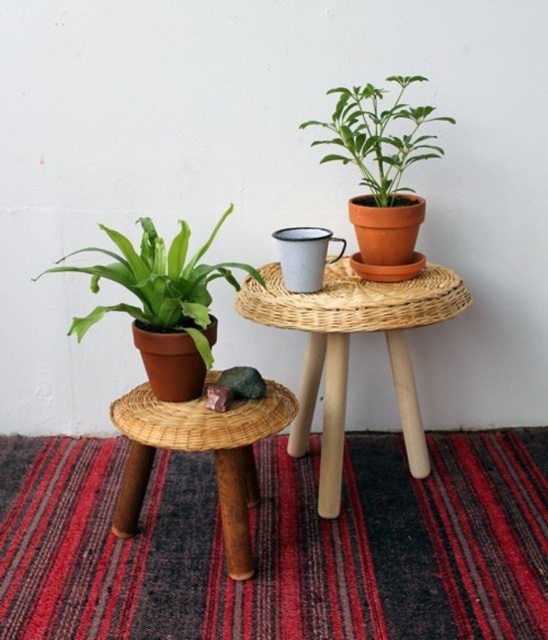
You are arranging a living room and need to place a tall potted plant that requires a sturdy base. Which object from the image, the woven wood table at center or the rattan stool at lower left, is better suited for supporting the plant?

The woven wood table at center is better suited for supporting the plant because it is above the rattan stool at lower left, indicating it has a larger surface area and stability.

You are arranging a small living room and see the rug with woven texture at lower center and the woven wood table at center. Which object is positioned to the left?

The rug with woven texture at lower center is to the left of the woven wood table at center.

Looking at this image, you are standing in front of the two tables and want to place a new decoration. If you place it at point A at point[168,433] and point B at point[145,320], which point is closer to you?

Point A at point[168,433] is closer to you than point B at point[145,320].